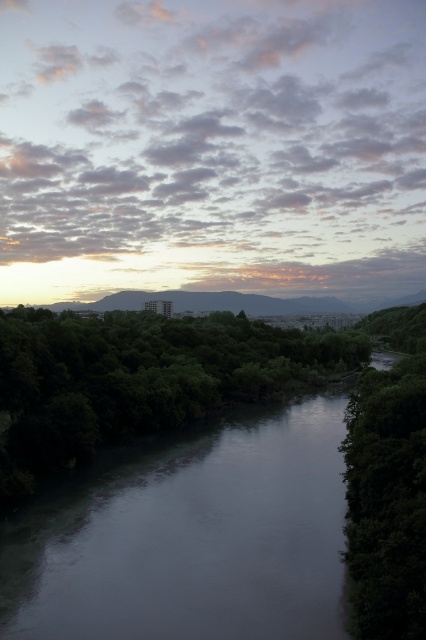
Is smooth gray river at center to the right of green leafy tree at right from the viewer's perspective?

In fact, smooth gray river at center is to the left of green leafy tree at right.

Is smooth gray river at center to the left of green leafy tree at right from the viewer's perspective?

Correct, you'll find smooth gray river at center to the left of green leafy tree at right.

Describe the element at coordinates (189, 536) in the screenshot. I see `smooth gray river at center` at that location.

Where is `smooth gray river at center`? The height and width of the screenshot is (640, 426). smooth gray river at center is located at coordinates (189, 536).

Locate an element on the screen. Image resolution: width=426 pixels, height=640 pixels. green leafy trees at lower left is located at coordinates [141, 378].

Who is more forward, (232, 324) or (411, 362)?

Point (411, 362)

Does point (256, 387) lie behind point (420, 308)?

No, it is in front of (420, 308).

The height and width of the screenshot is (640, 426). I want to click on green leafy trees at lower left, so click(141, 378).

Can you confirm if smooth gray river at center is positioned below green leafy trees at lower left?

Yes.

Between point (155, 560) and point (101, 408), which one is positioned in front?

Point (155, 560) is in front.

The width and height of the screenshot is (426, 640). Identify the location of smooth gray river at center. (189, 536).